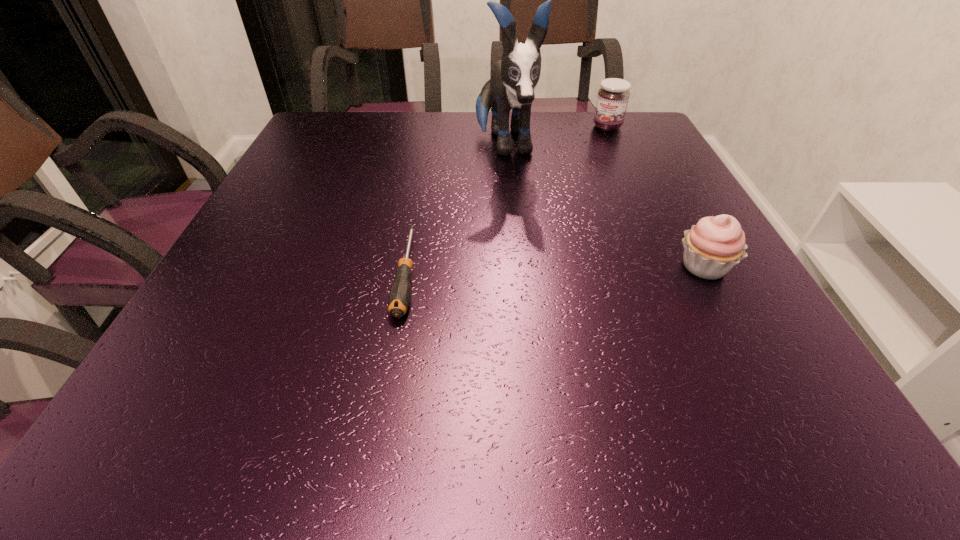
At what (x,y) coordinates should I click in order to perform the action: click on vacant area at the near edge. Please return your answer as a coordinate pair (x, y). Looking at the image, I should click on (455, 335).

This screenshot has height=540, width=960. In the image, there is a desktop. What are the coordinates of `free region at the left edge` in the screenshot? It's located at (276, 190).

Where is `free region at the right edge`? Image resolution: width=960 pixels, height=540 pixels. free region at the right edge is located at coordinates (742, 284).

This screenshot has height=540, width=960. In the image, there is a desktop. Find the location of `free space at the far right corner`. free space at the far right corner is located at coordinates (649, 123).

The width and height of the screenshot is (960, 540). What are the coordinates of `vacant space at the near right corner` in the screenshot? It's located at (805, 373).

The height and width of the screenshot is (540, 960). I want to click on blank region between the jam and the shortest object, so click(507, 200).

At what (x,y) coordinates should I click in order to perform the action: click on vacant space that's between the second object from left to right and the jam. Please return your answer as a coordinate pair (x, y). This screenshot has width=960, height=540. Looking at the image, I should click on (556, 136).

Find the location of a particular element. vacant space that is in between the jam and the shortest object is located at coordinates (507, 200).

The height and width of the screenshot is (540, 960). In order to click on vacant area that lies between the screwdriver and the tallest object in this screenshot , I will do `click(455, 209)`.

Where is `free space between the tallest object and the leftmost object`? free space between the tallest object and the leftmost object is located at coordinates (455, 209).